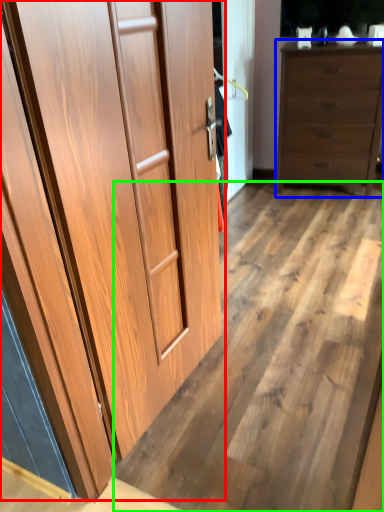
Question: Estimate the real-world distances between objects in this image. Which object is farther from cupboard (highlighted by a red box), chest of drawers (highlighted by a blue box) or plywood (highlighted by a green box)?

Choices:
 (A) chest of drawers
 (B) plywood

Answer: (A)